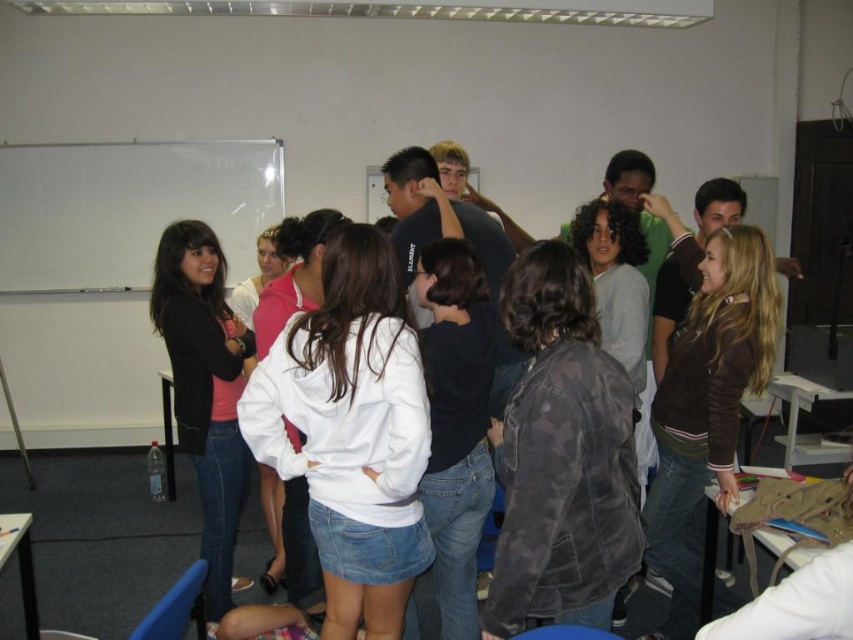
Does point (308, 470) come closer to viewer compared to point (192, 333)?

Yes.

Between white cotton hoodie at center and matte black hoodie at center, which one appears on the right side from the viewer's perspective?

From the viewer's perspective, white cotton hoodie at center appears more on the right side.

What are the coordinates of `white cotton hoodie at center` in the screenshot? It's located at (351, 432).

Where is `white cotton hoodie at center`? This screenshot has width=853, height=640. white cotton hoodie at center is located at coordinates (351, 432).

Can you confirm if dark gray denim jacket at center is positioned above matte black hoodie at center?

Actually, dark gray denim jacket at center is below matte black hoodie at center.

Can you confirm if dark gray denim jacket at center is smaller than matte black hoodie at center?

Yes, dark gray denim jacket at center is smaller than matte black hoodie at center.

You are a GUI agent. You are given a task and a screenshot of the screen. Output one action in this format:
    pyautogui.click(x=<x>, y=<y>)
    Task: Click on the dark gray denim jacket at center
    This screenshot has height=640, width=853.
    Given the screenshot: What is the action you would take?
    pyautogui.click(x=456, y=422)

I want to click on dark gray denim jacket at center, so click(456, 422).

Which is in front, point (685, 544) or point (202, 442)?

Point (202, 442) is more forward.

This screenshot has width=853, height=640. I want to click on brown suede jacket at center, so click(706, 397).

Is point (755, 292) closer to camera compared to point (210, 609)?

Yes.

Locate an element on the screen. brown suede jacket at center is located at coordinates (706, 397).